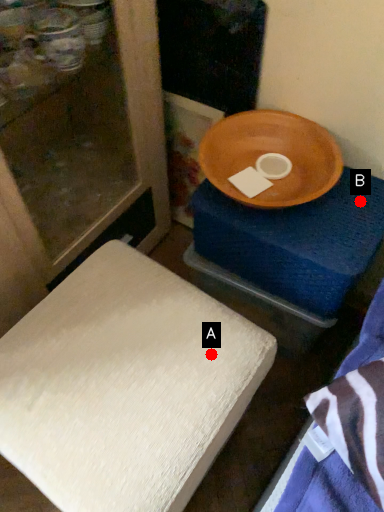
Question: Two points are circled on the image, labeled by A and B beside each circle. Which point is farther to the camera?

Choices:
 (A) A is further
 (B) B is further

Answer: (B)